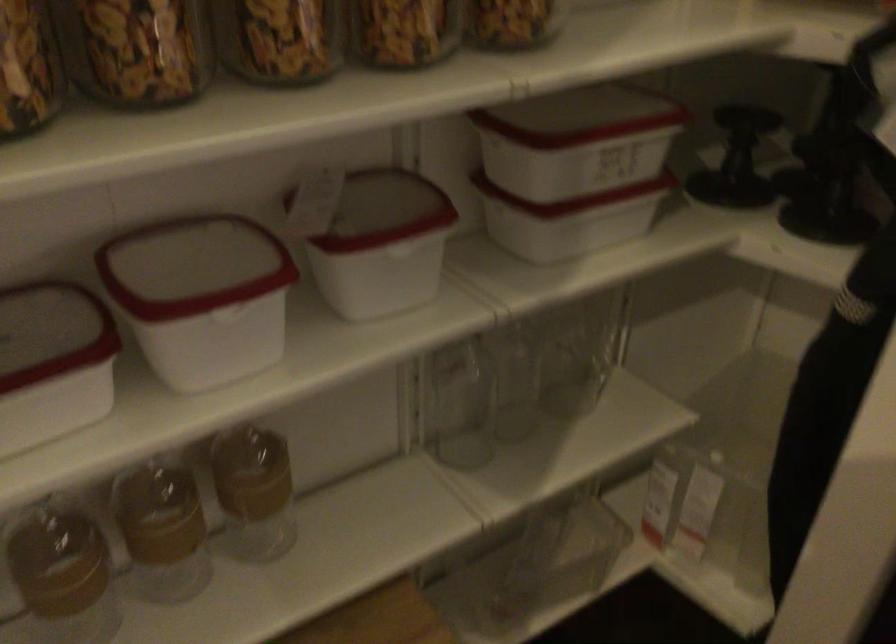
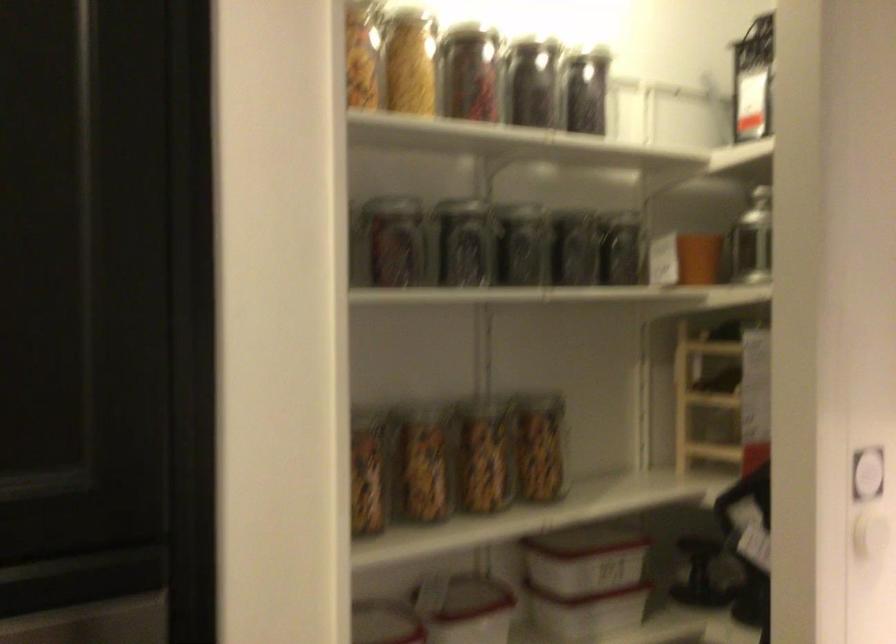
The point at (736, 154) is marked in the first image. Where is the corresponding point in the second image?

(700, 574)